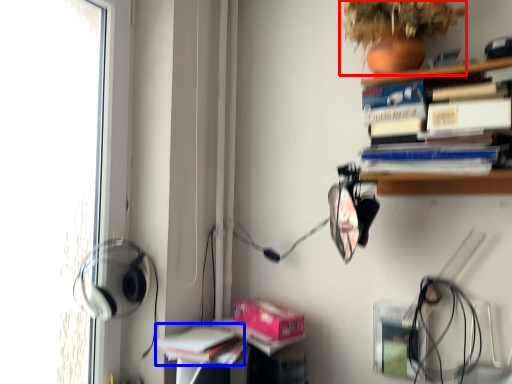
Question: Which point is closer to the camera, plant (highlighted by a red box) or book (highlighted by a blue box)?

Choices:
 (A) plant
 (B) book

Answer: (A)